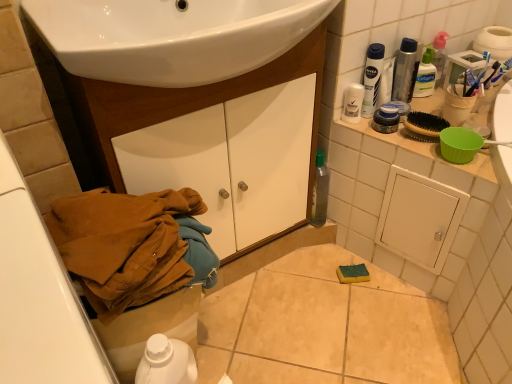
The width and height of the screenshot is (512, 384). What are the coordinates of `vacant region in front of blue glossy jar at upper right, marked as the 1th mouthwash in a bottom-to-top arrangement` in the screenshot? It's located at tap(416, 152).